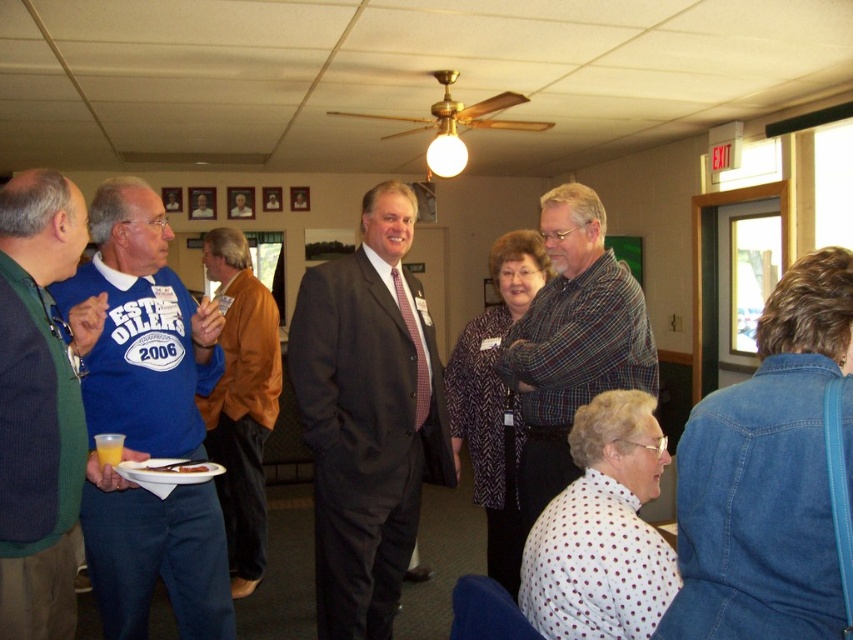
Can you confirm if blue cotton shirt at left is wider than orange leather jacket at center?

Indeed, blue cotton shirt at left has a greater width compared to orange leather jacket at center.

In the scene shown: Can you confirm if blue cotton shirt at left is positioned below orange leather jacket at center?

Incorrect, blue cotton shirt at left is not positioned below orange leather jacket at center.

The width and height of the screenshot is (853, 640). I want to click on blue cotton shirt at left, so click(x=140, y=328).

Is dark gray suit at center to the right of orange leather jacket at center from the viewer's perspective?

Yes, dark gray suit at center is to the right of orange leather jacket at center.

Does point (432, 392) come in front of point (245, 483)?

Yes, point (432, 392) is in front of point (245, 483).

Find the location of a particular element. dark gray suit at center is located at coordinates (367, 417).

Does plaid shirt at center appear on the right side of orange leather jacket at center?

Indeed, plaid shirt at center is positioned on the right side of orange leather jacket at center.

Who is positioned more to the left, plaid shirt at center or orange leather jacket at center?

From the viewer's perspective, orange leather jacket at center appears more on the left side.

Locate an element on the screen. This screenshot has height=640, width=853. plaid shirt at center is located at coordinates (572, 340).

Identify the location of plaid shirt at center. The width and height of the screenshot is (853, 640). (572, 340).